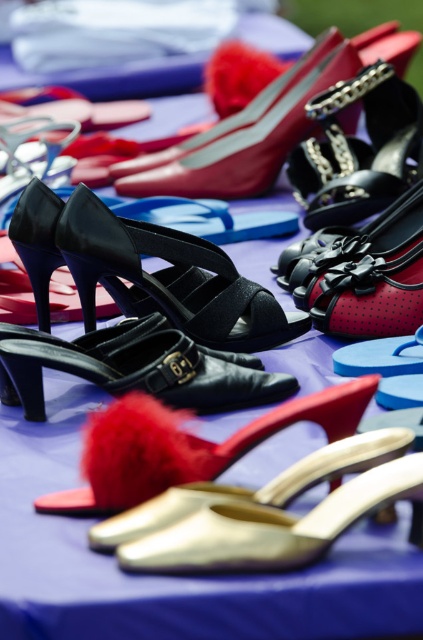
Question: Which object is closer to the camera taking this photo?

Choices:
 (A) velvet black sandal at center
 (B) shiny leather high-heeled shoe at upper center
 (C) gold metallic sandal at lower center

Answer: (C)

Question: In this image, where is velvet black sandal at center located relative to black leather shoe at center?

Choices:
 (A) left
 (B) right

Answer: (B)

Question: Does velvet black sandal at center have a larger size compared to black leather shoe at center?

Choices:
 (A) yes
 (B) no

Answer: (A)

Question: Which point is farther to the camera?

Choices:
 (A) (159, 332)
 (B) (329, 518)
 (C) (277, 99)
 (D) (211, 298)

Answer: (C)

Question: Which point is farther from the camera taking this photo?

Choices:
 (A) (109, 349)
 (B) (337, 525)

Answer: (A)

Question: Does velvet black sandal at center appear over shiny leather high-heeled shoe at upper center?

Choices:
 (A) no
 (B) yes

Answer: (A)